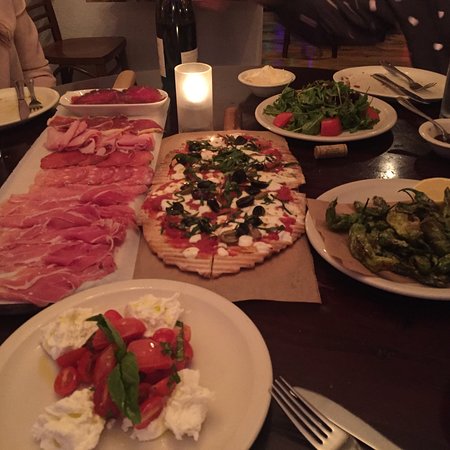
Identify the location of wood board. (173, 137).